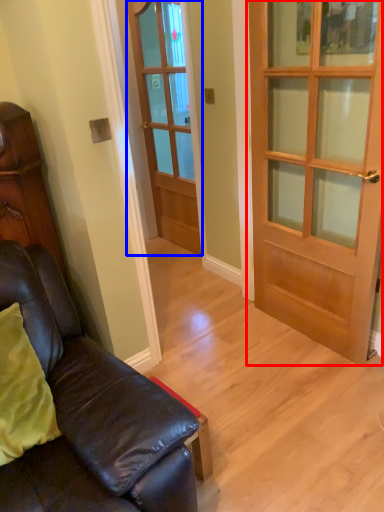
Question: Which object appears closest to the camera in this image, door (highlighted by a red box) or door (highlighted by a blue box)?

Choices:
 (A) door
 (B) door

Answer: (A)